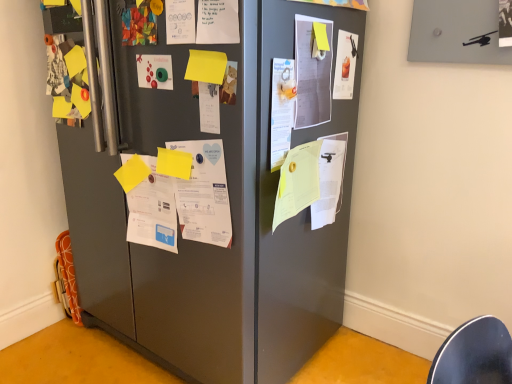
Question: Is the depth of white paper at center, placed as the third poster when sorted from right to left, greater than that of matte green button at center, acting as the eighth poster starting from the right?

Choices:
 (A) no
 (B) yes

Answer: (A)

Question: From the image's perspective, is white paper at center, placed as the third poster when sorted from right to left, beneath matte green button at center, acting as the eighth poster starting from the right?

Choices:
 (A) no
 (B) yes

Answer: (B)

Question: Considering the relative sizes of white paper at center, the sixth poster viewed from the left, and matte green button at center, which is the 1th poster in left-to-right order, in the image provided, is white paper at center, the sixth poster viewed from the left, taller than matte green button at center, which is the 1th poster in left-to-right order,?

Choices:
 (A) no
 (B) yes

Answer: (B)

Question: Can you confirm if white paper at center, the sixth poster viewed from the left, is positioned to the right of matte green button at center, acting as the eighth poster starting from the right?

Choices:
 (A) no
 (B) yes

Answer: (B)

Question: From a real-world perspective, is white paper at center, placed as the third poster when sorted from right to left, located beneath matte green button at center, which is the 1th poster in left-to-right order?

Choices:
 (A) yes
 (B) no

Answer: (A)

Question: From a real-world perspective, relative to white paper at center, which is the fourth poster from left to right, is white paper at center, the sixth poster viewed from the left, vertically above or below?

Choices:
 (A) below
 (B) above

Answer: (A)

Question: In the image, is white paper at center, placed as the third poster when sorted from right to left, on the left side or the right side of white paper at center, arranged as the fifth poster when viewed from the right?

Choices:
 (A) left
 (B) right

Answer: (B)

Question: From the image's perspective, relative to white paper at center, which is the fourth poster from left to right, is white paper at center, the sixth poster viewed from the left, above or below?

Choices:
 (A) below
 (B) above

Answer: (A)

Question: Is white paper at center, the sixth poster viewed from the left, wider or thinner than white paper at center, which is the fourth poster from left to right?

Choices:
 (A) wide
 (B) thin

Answer: (B)

Question: Considering the positions of yellow paper at center, which appears as the fifth paper when viewed from the left, and matte green button at center, which is the 1th poster in left-to-right order, in the image, is yellow paper at center, which appears as the fifth paper when viewed from the left, wider or thinner than matte green button at center, which is the 1th poster in left-to-right order,?

Choices:
 (A) thin
 (B) wide

Answer: (B)

Question: In the image, is yellow paper at center, the 2th paper positioned from the right, positioned in front of or behind matte green button at center, which is the 1th poster in left-to-right order?

Choices:
 (A) front
 (B) behind

Answer: (A)

Question: From the image's perspective, is yellow paper at center, which appears as the fifth paper when viewed from the left, located above or below matte green button at center, acting as the eighth poster starting from the right?

Choices:
 (A) below
 (B) above

Answer: (A)

Question: Is point (287, 196) closer or farther from the camera than point (161, 82)?

Choices:
 (A) farther
 (B) closer

Answer: (A)

Question: Relative to white paper at center, placed as the third poster when sorted from right to left, is yellow matte paper at center-left, placed as the 6th paper when sorted from right to left, in front or behind?

Choices:
 (A) front
 (B) behind

Answer: (B)

Question: Is yellow matte paper at center-left, placed as the 6th paper when sorted from right to left, wider or thinner than white paper at center, placed as the third poster when sorted from right to left?

Choices:
 (A) wide
 (B) thin

Answer: (A)